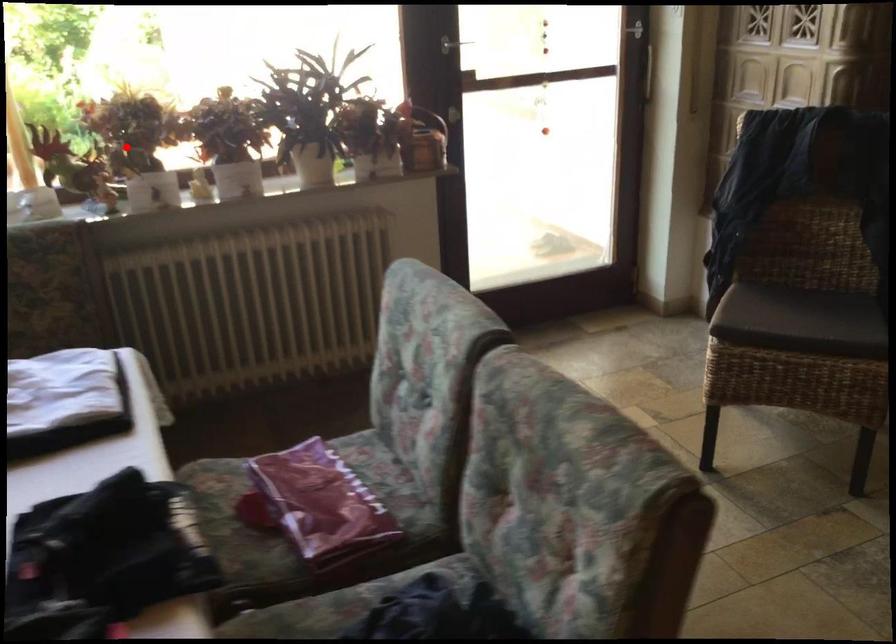
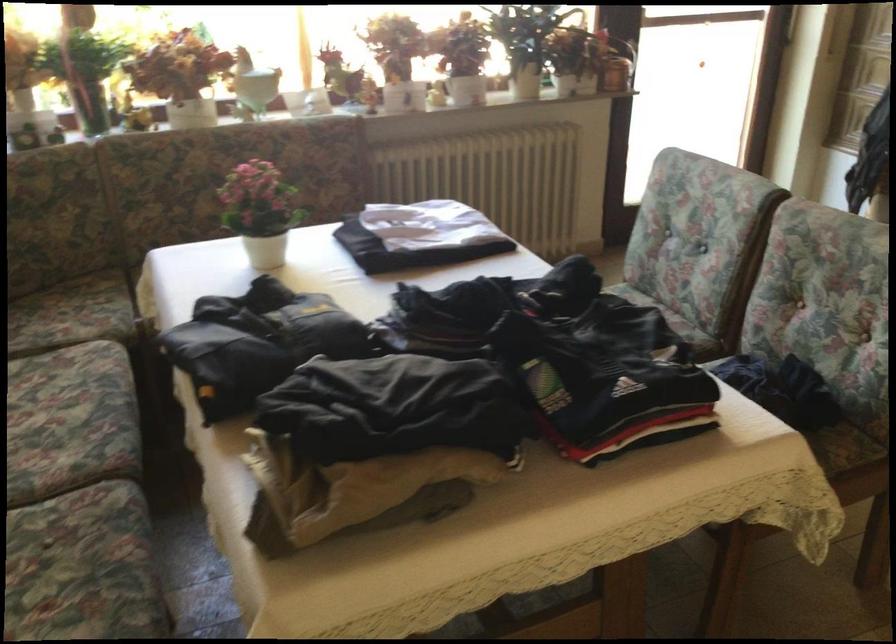
Where in the second image is the point corresponding to the highlighted location from the first image?

(397, 57)